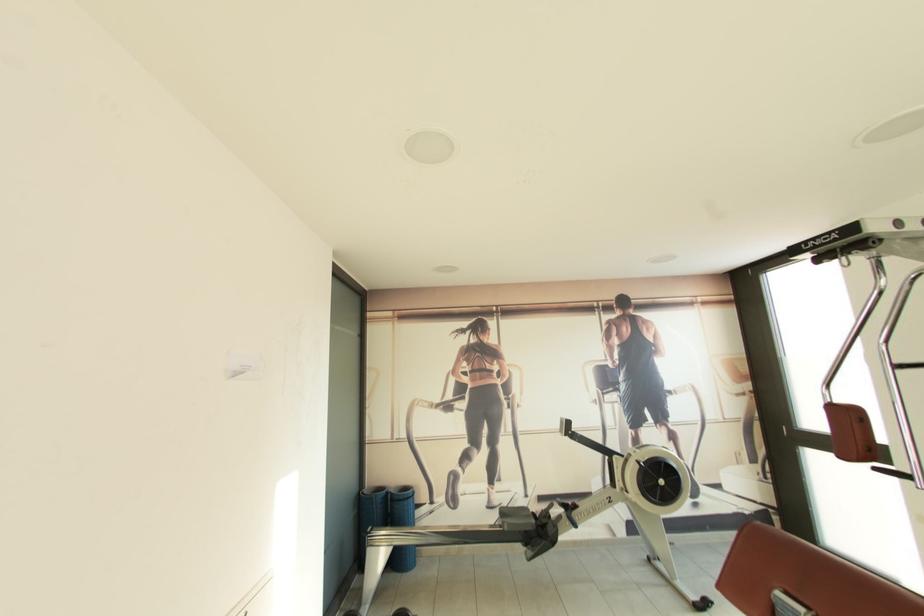
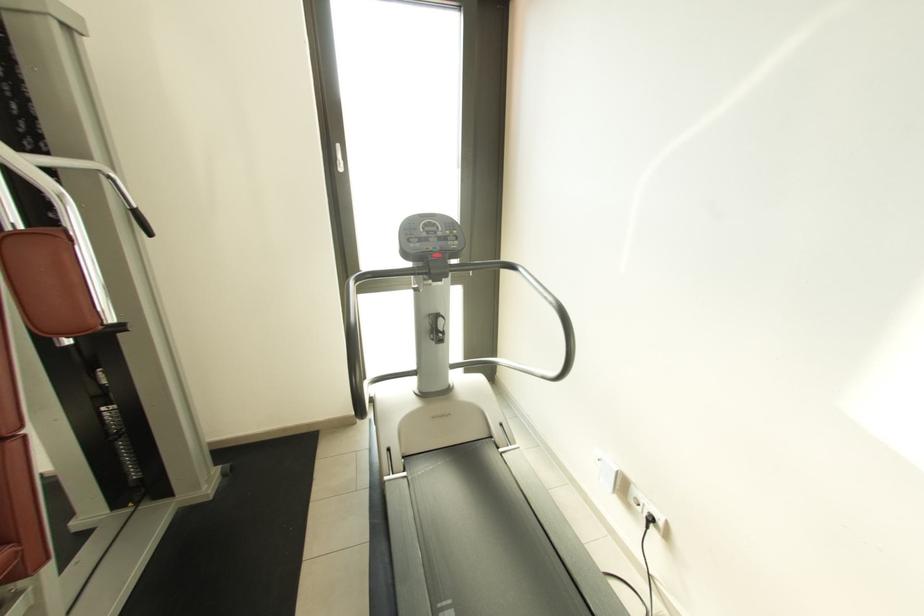
Question: The camera is either moving clockwise (left) or counter-clockwise (right) around the object. The first image is from the beginning of the video and the second image is from the end. Is the camera moving left or right when shooting the video?

Choices:
 (A) Left
 (B) Right

Answer: (A)